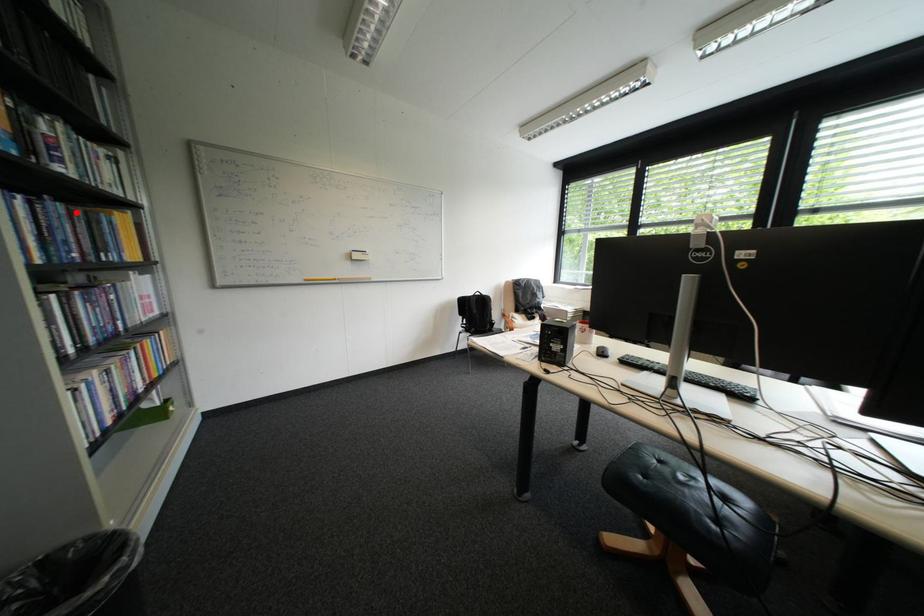
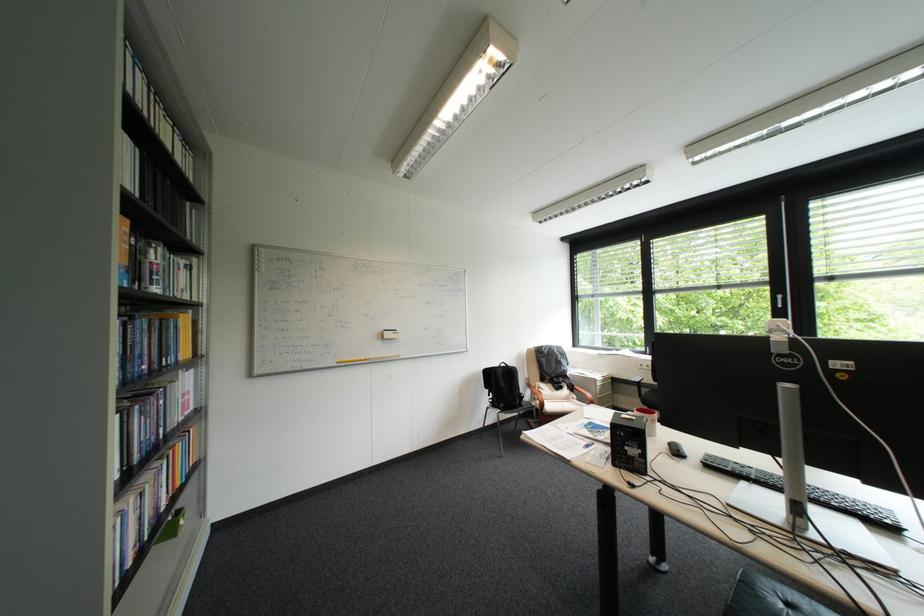
Locate, in the second image, the point that corresponds to the highlighted location in the first image.

(159, 326)